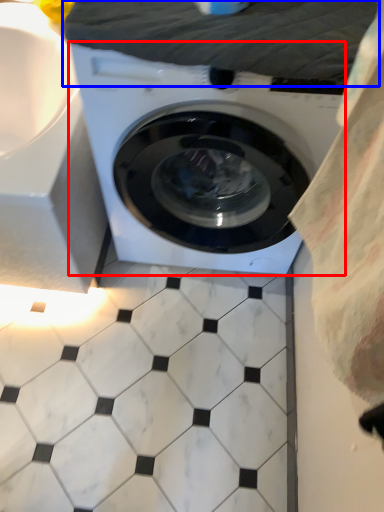
Question: Among these objects, which one is farthest to the camera, washing machine (highlighted by a red box) or sheet (highlighted by a blue box)?

Choices:
 (A) washing machine
 (B) sheet

Answer: (B)